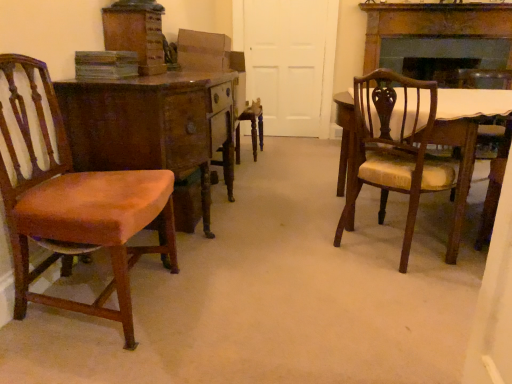
Question: Looking at the image, does wooden desk at left seem bigger or smaller compared to matte brown chair at left, the first chair from the left?

Choices:
 (A) small
 (B) big

Answer: (B)

Question: From the image's perspective, relative to matte brown chair at left, the first chair from the left, is wooden desk at left above or below?

Choices:
 (A) below
 (B) above

Answer: (B)

Question: Estimate the real-world distances between objects in this image. Which object is closer to the matte brown chair at right, positioned as the first chair in right-to-left order?

Choices:
 (A) wooden desk at left
 (B) white matte door at center
 (C) matte brown chair at left, the first chair from the left

Answer: (A)

Question: Which of these objects is positioned closest to the wooden desk at left?

Choices:
 (A) white matte door at center
 (B) matte brown chair at left, the first chair from the left
 (C) matte brown chair at right, positioned as the first chair in right-to-left order

Answer: (B)